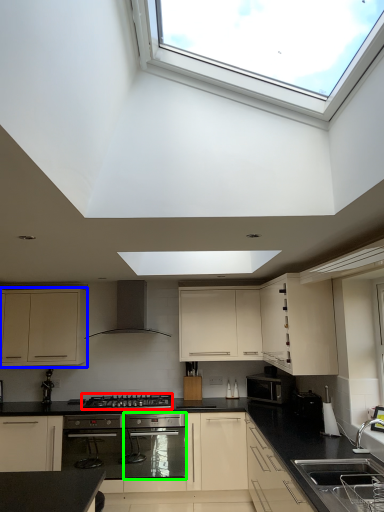
Question: Which is nearer to the gas stove (highlighted by a red box)? cabinetry (highlighted by a blue box) or oven (highlighted by a green box).

Choices:
 (A) cabinetry
 (B) oven

Answer: (B)